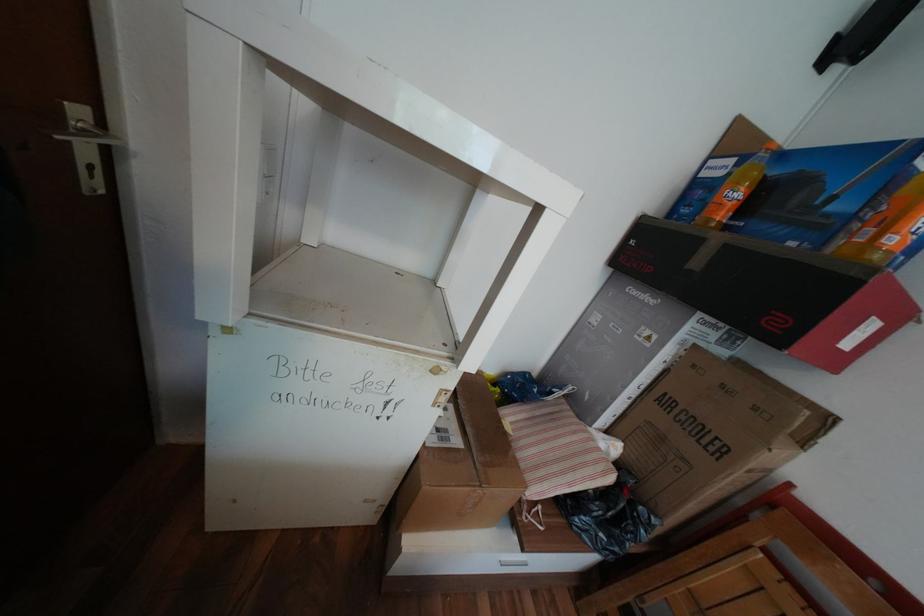
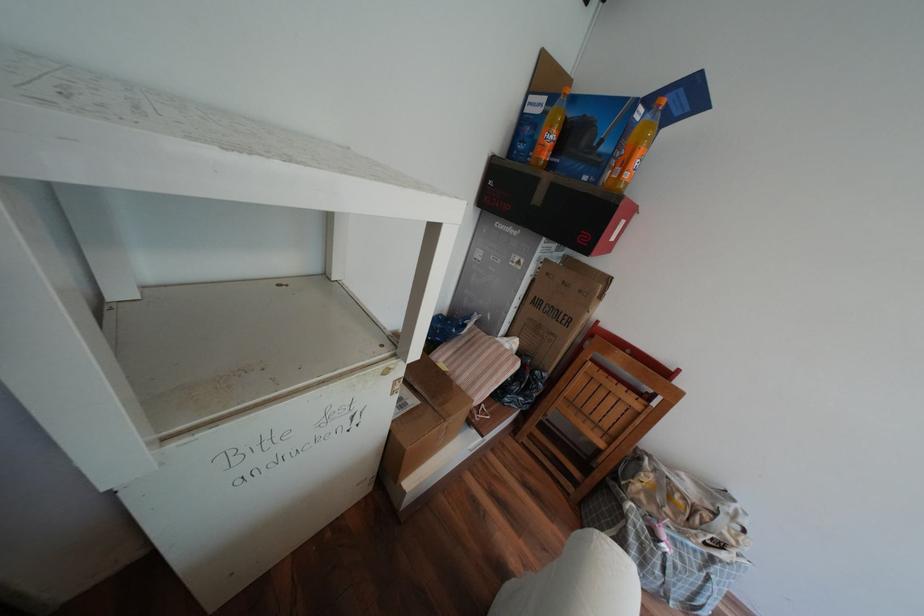
The point at (747,184) is marked in the first image. Where is the corresponding point in the second image?

(561, 127)